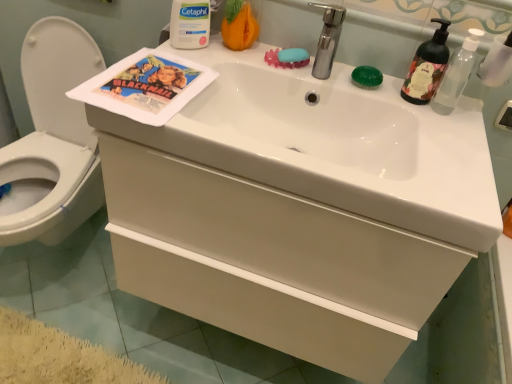
Question: Is point (450, 94) closer or farther from the camera than point (182, 0)?

Choices:
 (A) farther
 (B) closer

Answer: (A)

Question: Is translucent plastic pump bottle at upper right taller or shorter than white matte cetaphil container at upper center?

Choices:
 (A) short
 (B) tall

Answer: (B)

Question: Estimate the real-world distances between objects in this image. Which object is closer to the green matte soap at upper right, acting as the second soap starting from the left?

Choices:
 (A) translucent plastic pump bottle at upper right
 (B) white matte drawer at center
 (C) white glossy sink at center
 (D) green matte soap dispenser at upper right
 (E) white glossy toilet at left

Answer: (D)

Question: Which is farther from the green matte soap dispenser at upper right?

Choices:
 (A) blue matte soap at upper center, the first soap positioned from the left
 (B) silver metallic faucet at upper center
 (C) white matte drawer at center
 (D) white glossy toilet at left
 (E) green matte soap at upper right, acting as the second soap starting from the left

Answer: (D)